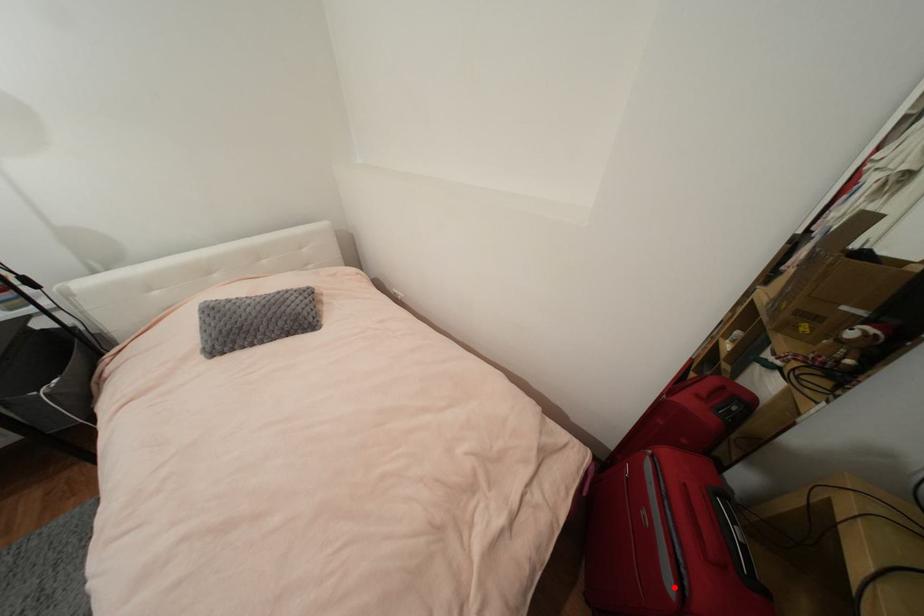
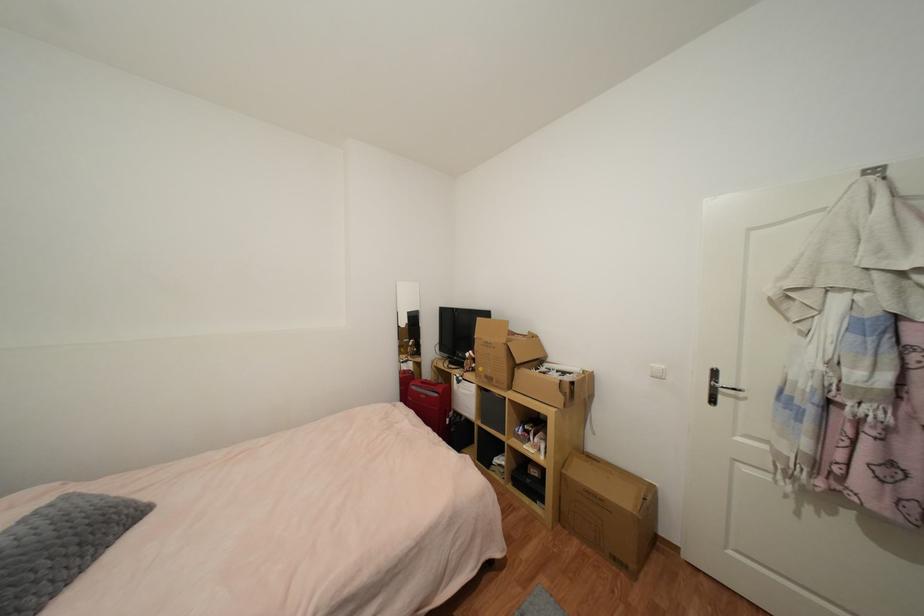
In the second image, find the point that corresponds to the highlighted location in the first image.

(440, 397)